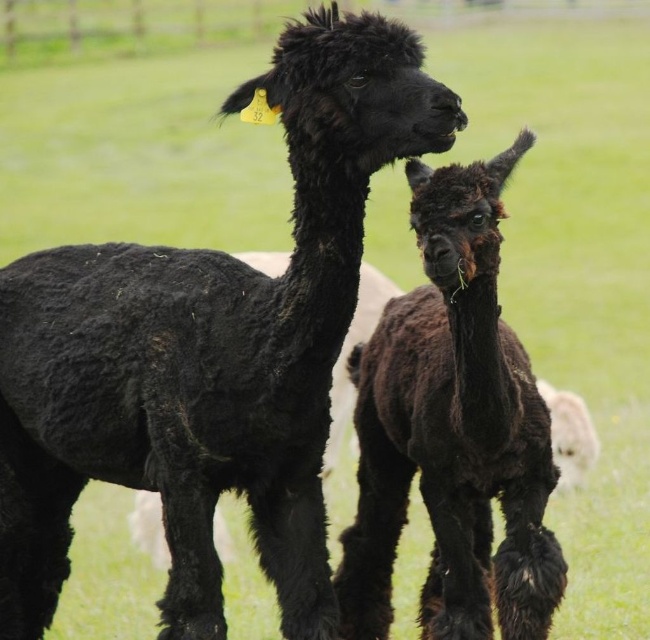
Between black woolly alpaca at left and shiny black alpaca at center, which one has less height?

Standing shorter between the two is shiny black alpaca at center.

Who is more distant from viewer, (304,385) or (512,388)?

The point (512,388) is behind.

At what (x,y) coordinates should I click in order to perform the action: click on black woolly alpaca at left. Please return your answer as a coordinate pair (x, y). This screenshot has width=650, height=640. Looking at the image, I should click on (209, 349).